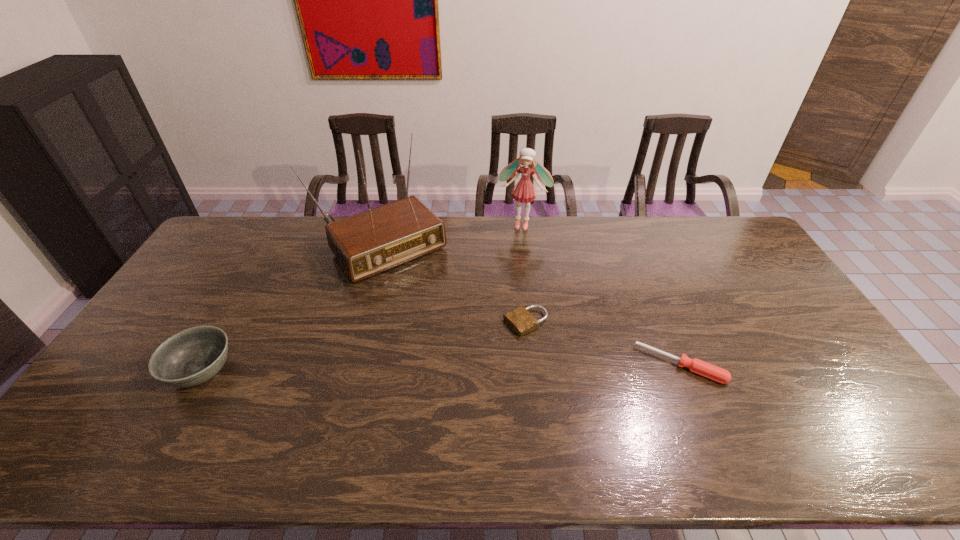
This screenshot has height=540, width=960. Find the location of `vacant space situated on the keyhole side of the padlock`. vacant space situated on the keyhole side of the padlock is located at coordinates (396, 387).

Find the location of a particular element. The height and width of the screenshot is (540, 960). vacant space situated 0.190m on the keyhole side of the padlock is located at coordinates (452, 359).

Where is `free spot located on the keyhole side of the padlock`? This screenshot has height=540, width=960. free spot located on the keyhole side of the padlock is located at coordinates (443, 363).

This screenshot has height=540, width=960. In order to click on free location located on the front panel of the radio_receiver in this screenshot , I will do coord(475,354).

The width and height of the screenshot is (960, 540). I want to click on blank space located 0.110m on the front panel of the radio_receiver, so pos(428,298).

The width and height of the screenshot is (960, 540). I want to click on vacant area located 0.260m on the front panel of the radio_receiver, so click(x=452, y=328).

Find the location of a particular element. free spot located on the front-facing side of the doll is located at coordinates (513, 254).

You are a GUI agent. You are given a task and a screenshot of the screen. Output one action in this format:
    pyautogui.click(x=<x>, y=<y>)
    Task: Click on the blank space located 0.230m on the front-facing side of the doll
    The width and height of the screenshot is (960, 540).
    Given the screenshot: What is the action you would take?
    pyautogui.click(x=508, y=271)

The width and height of the screenshot is (960, 540). In order to click on free spot located 0.370m on the front-facing side of the doll in this screenshot , I will do `click(500, 299)`.

The width and height of the screenshot is (960, 540). I want to click on radio_receiver that is at the far edge, so click(368, 243).